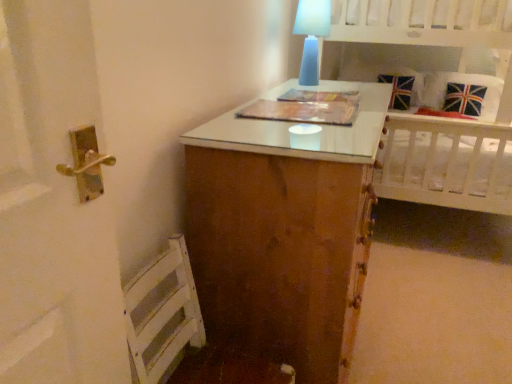
Question: In terms of size, does union jack fabric pillow at upper right appear bigger or smaller than white wooden bed at upper right?

Choices:
 (A) small
 (B) big

Answer: (A)

Question: Is union jack fabric pillow at upper right spatially inside white wooden bed at upper right, or outside of it?

Choices:
 (A) outside
 (B) inside

Answer: (B)

Question: Which is nearer to the union jack fabric pillow at upper right?

Choices:
 (A) blue frosted glass table lamp at upper center
 (B) white wooden bed at upper right

Answer: (B)

Question: Estimate the real-world distances between objects in this image. Which object is farther from the blue frosted glass table lamp at upper center?

Choices:
 (A) white wooden bed at upper right
 (B) union jack fabric pillow at upper right

Answer: (B)